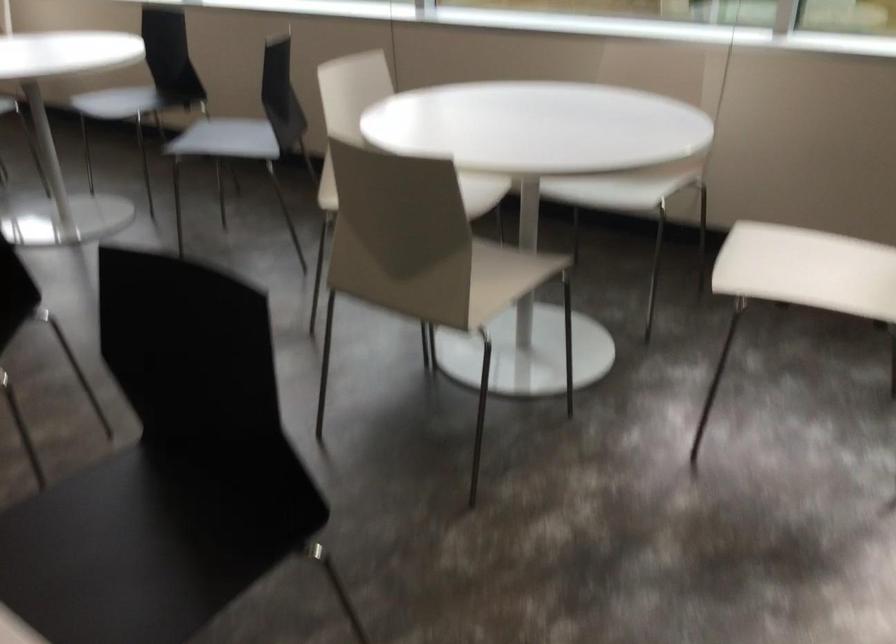
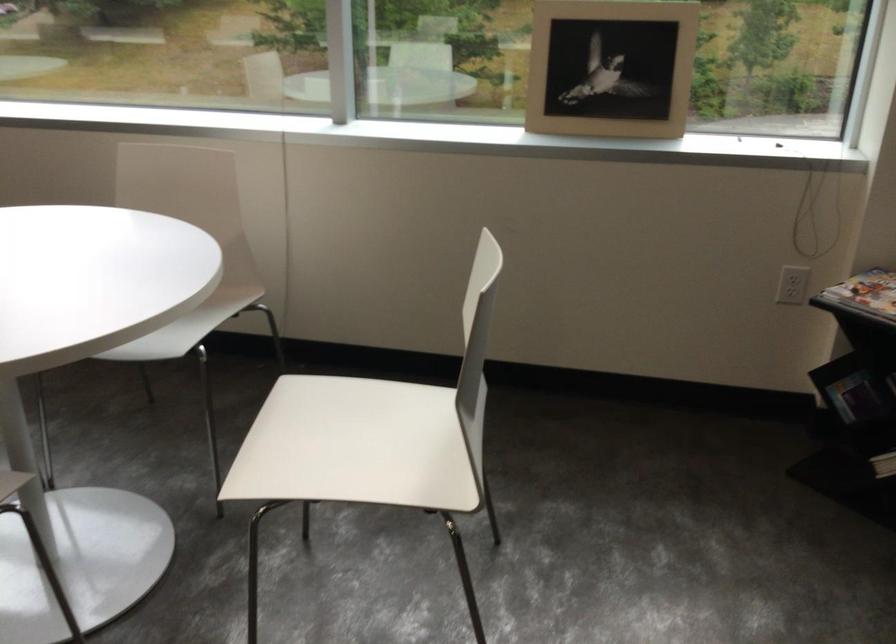
In the second image, find the point that corresponds to the point at 800,277 in the first image.

(356, 446)